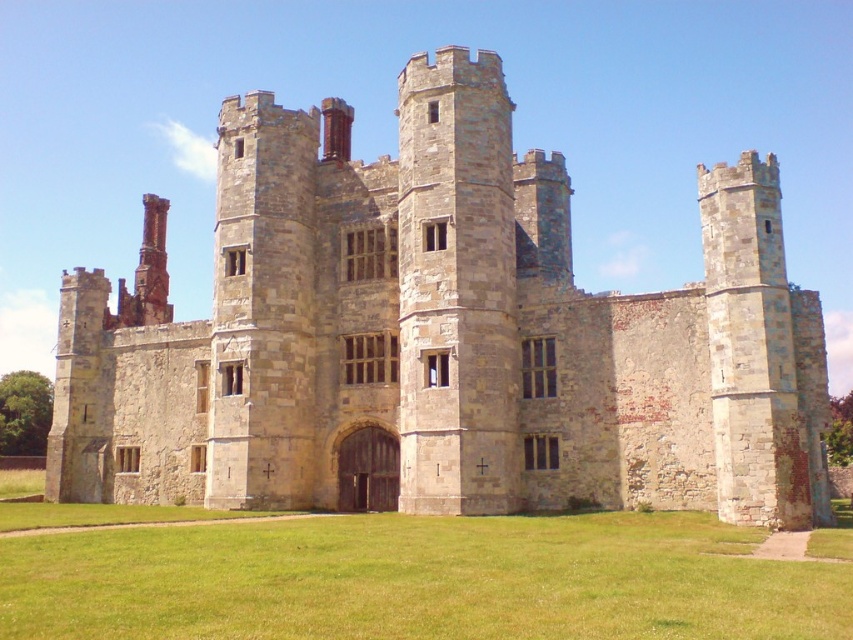
You are standing at the coordinates of point A, which is located at the center of the image. If you want to walk towards the stone castle at center, in which direction should you move?

The stone castle at center is located at point coordinates of (x=440, y=337). Since you are at the center of the image, which is typically point (x=426, y=320), you should move slightly to the right and upwards to reach it.

You are a medieval architect planning to build a new structure in the courtyard of the stone castle at center. The courtyard has green grass at center. To ensure the new structure doesn not exceed the castle s width, what should you compare the proposed width against?

You should compare the proposed width of the new structure against the stone castle at center, since the stone castle at center is wider than the green grass at center according to the description.

You are standing in front of the historic stone castle. You notice two points marked on the castle walls at coordinates point (720, 342) and point (177, 618). Which of these points is closer to you?

Point (720, 342) is closer to you because it is further to the viewer than point (177, 618).